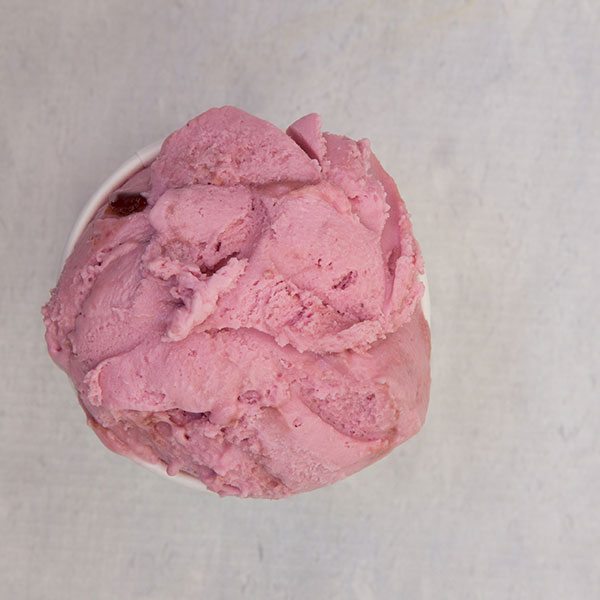
Find the location of a particular element. This screenshot has height=600, width=600. rim of cup is located at coordinates (187, 481), (426, 304), (84, 223).